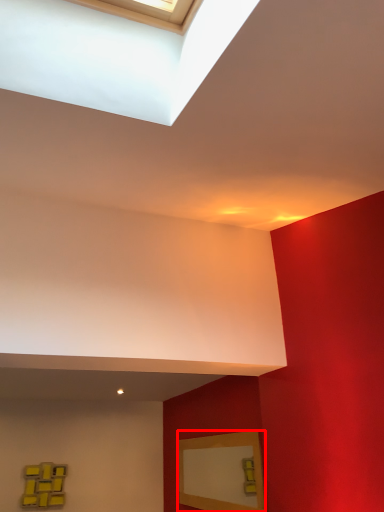
Question: Considering the relative positions of picture frame (annotated by the red box) and picture frame in the image provided, where is picture frame (annotated by the red box) located with respect to the staircase?

Choices:
 (A) right
 (B) left

Answer: (A)